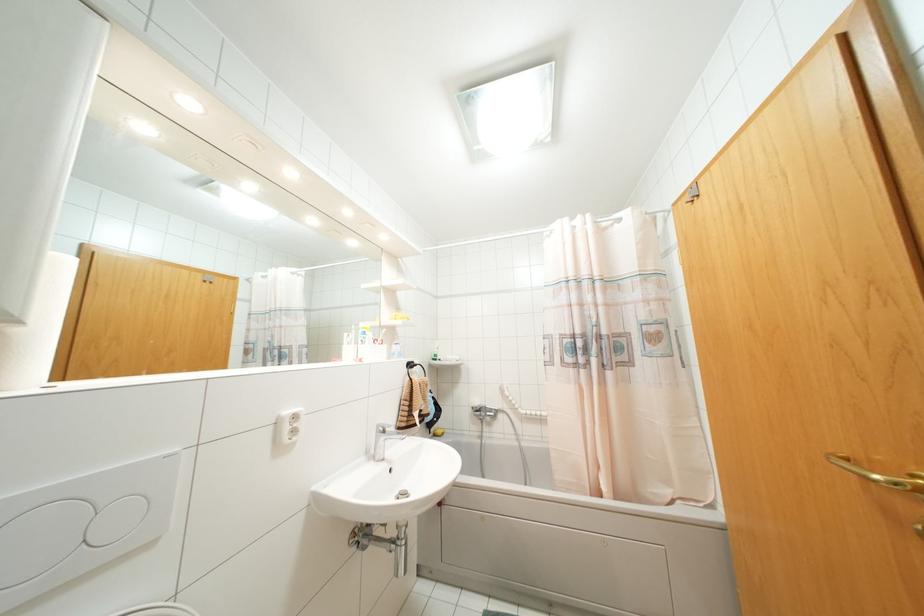
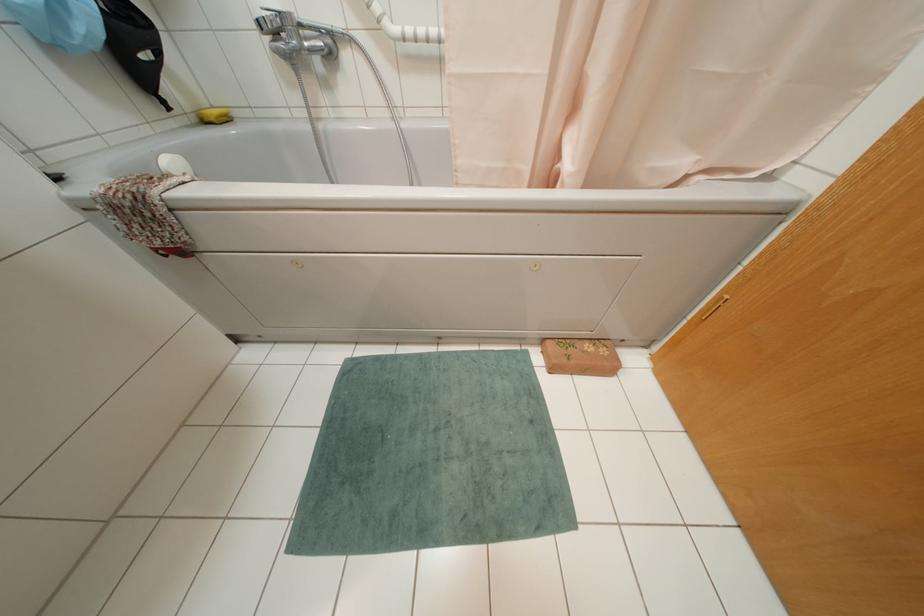
In the second image, find the point that corresponds to (x=434, y=435) in the first image.

(202, 121)